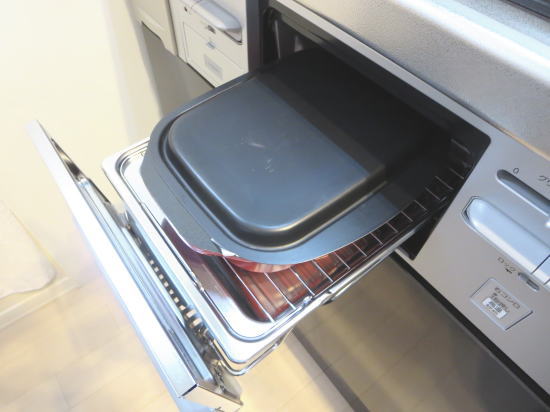
At what (x,y) coordinates should I click in order to perform the action: click on shadow from cabinet. Please return your answer as a coordinate pair (x, y). Looking at the image, I should click on (166, 67).